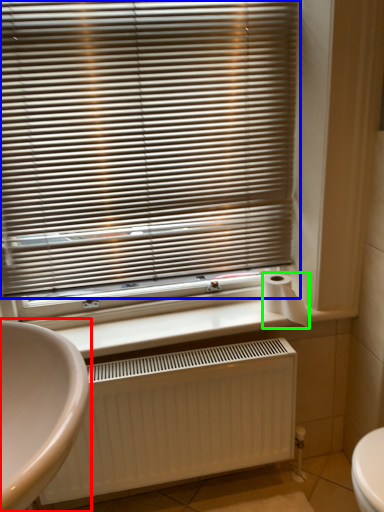
Question: Based on their relative distances, which object is nearer to sink (highlighted by a red box)? Choose from window blind (highlighted by a blue box) and toilet paper (highlighted by a green box).

Choices:
 (A) window blind
 (B) toilet paper

Answer: (A)